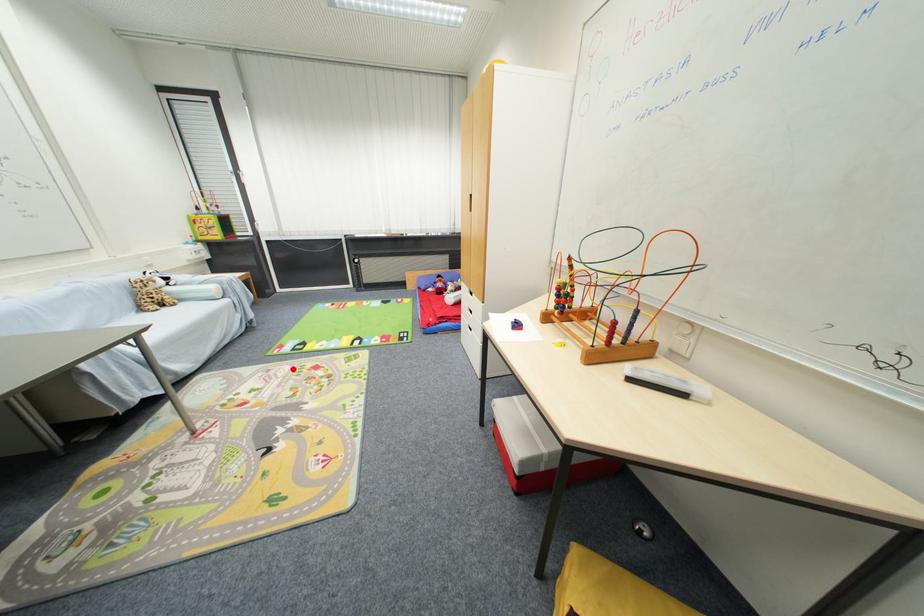
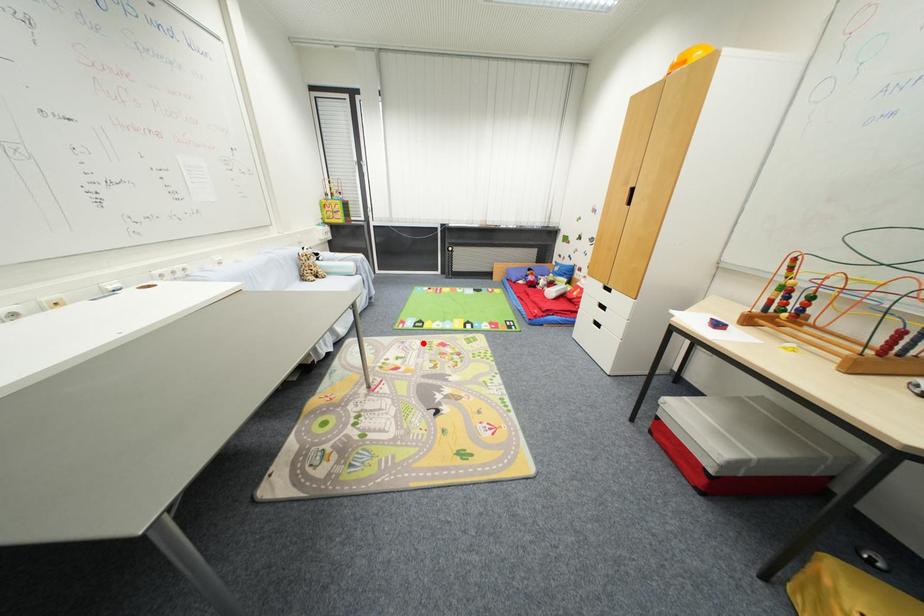
I am providing you with two images of the same scene from different viewpoints. A red point is marked on the first image and another point is marked on the second image. Is the red point in image1 aligned with the point shown in image2?

Yes